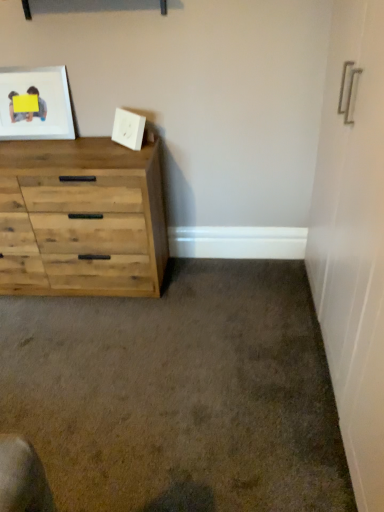
Find the location of a particular element. This screenshot has width=384, height=512. free space in front of white matte picture frame at upper center, which is counted as the 1th picture frame, starting from the right is located at coordinates (124, 154).